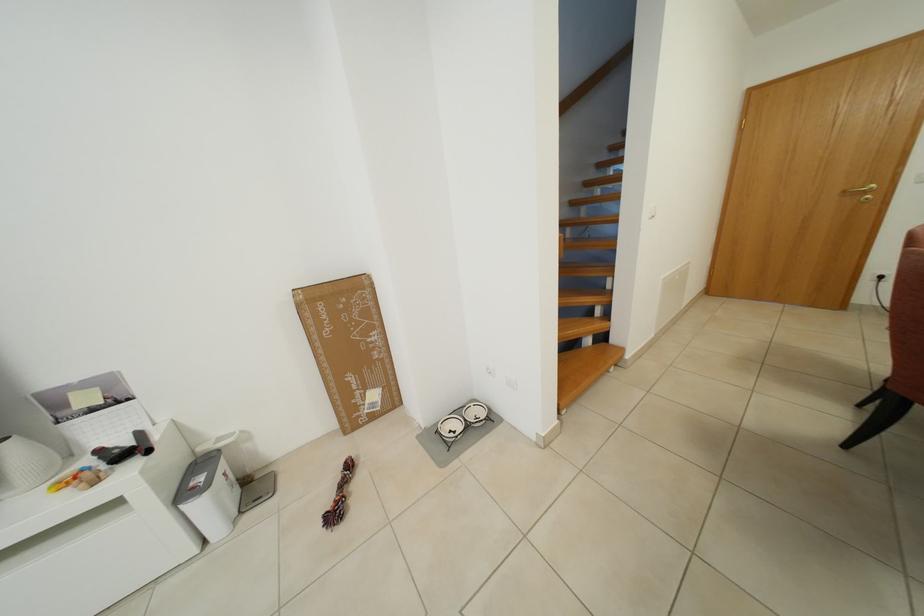
Where would you turn the gold door handle? Please return your answer as a coordinate pair (x, y).

(866, 192)